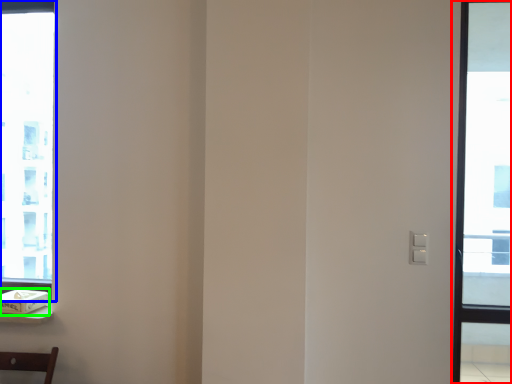
Question: Which is farther away from window (highlighted by a red box)? window (highlighted by a blue box) or box (highlighted by a green box)?

Choices:
 (A) window
 (B) box

Answer: (B)